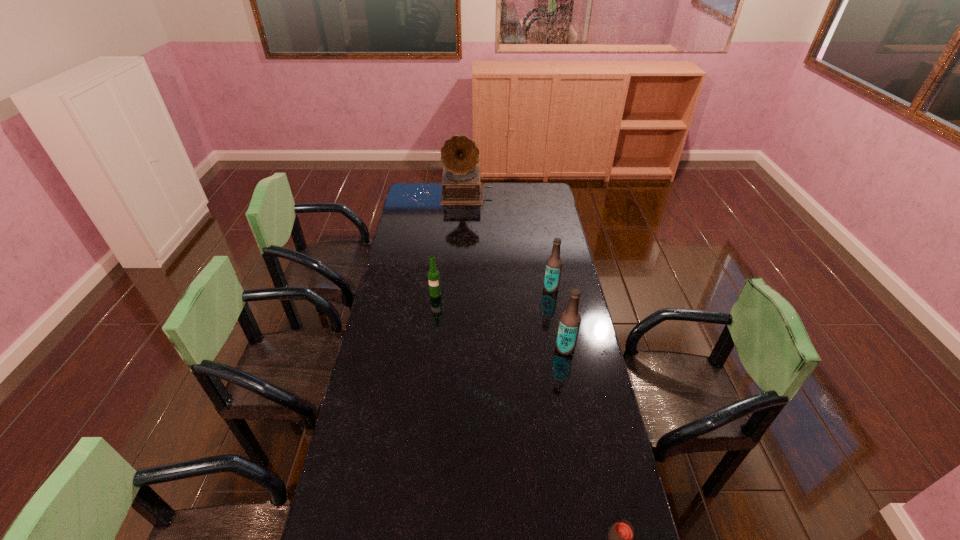
You are a GUI agent. You are given a task and a screenshot of the screen. Output one action in this format:
    pyautogui.click(x=<x>, y=<y>)
    Task: Click on the object located at the far edge
    This screenshot has height=540, width=960.
    Given the screenshot: What is the action you would take?
    pyautogui.click(x=461, y=185)

In the image, there is a desktop. At what (x,y) coordinates should I click in order to perform the action: click on vacant area at the far edge. Please return your answer as a coordinate pair (x, y). Looking at the image, I should click on (488, 194).

This screenshot has width=960, height=540. I want to click on vacant region at the left edge of the desktop, so click(393, 292).

Identify the location of vacant space at the right edge of the desktop. This screenshot has height=540, width=960. (564, 259).

This screenshot has height=540, width=960. In the image, there is a desktop. What are the coordinates of `free region at the far right corner` in the screenshot? It's located at (539, 194).

Identify which object is the closest to the tallest object. Please provide its 2D coordinates. Your answer should be formatted as a tuple, i.e. [(x, y)], where the tuple contains the x and y coordinates of a point satisfying the conditions above.

[(553, 269)]

You are a GUI agent. You are given a task and a screenshot of the screen. Output one action in this format:
    pyautogui.click(x=<x>, y=<y>)
    Task: Click on the third closest object to the second nearest object
    The height and width of the screenshot is (540, 960).
    Given the screenshot: What is the action you would take?
    pyautogui.click(x=621, y=534)

Point out which beer bottle is positioned as the nearest to the nearest object. Please provide its 2D coordinates. Your answer should be formatted as a tuple, i.e. [(x, y)], where the tuple contains the x and y coordinates of a point satisfying the conditions above.

[(570, 320)]

Where is `beer bottle identified as the third closest to the record player`? beer bottle identified as the third closest to the record player is located at coordinates (570, 320).